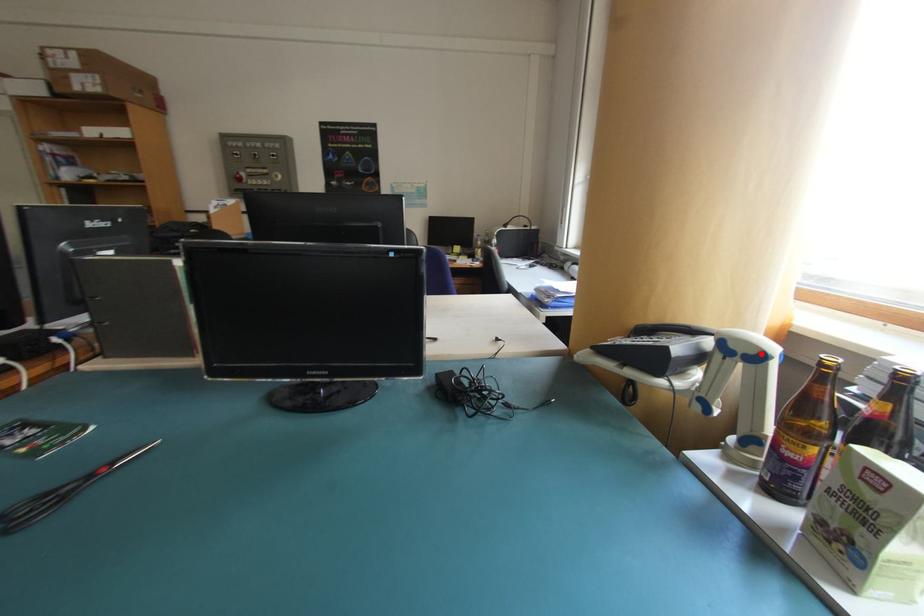
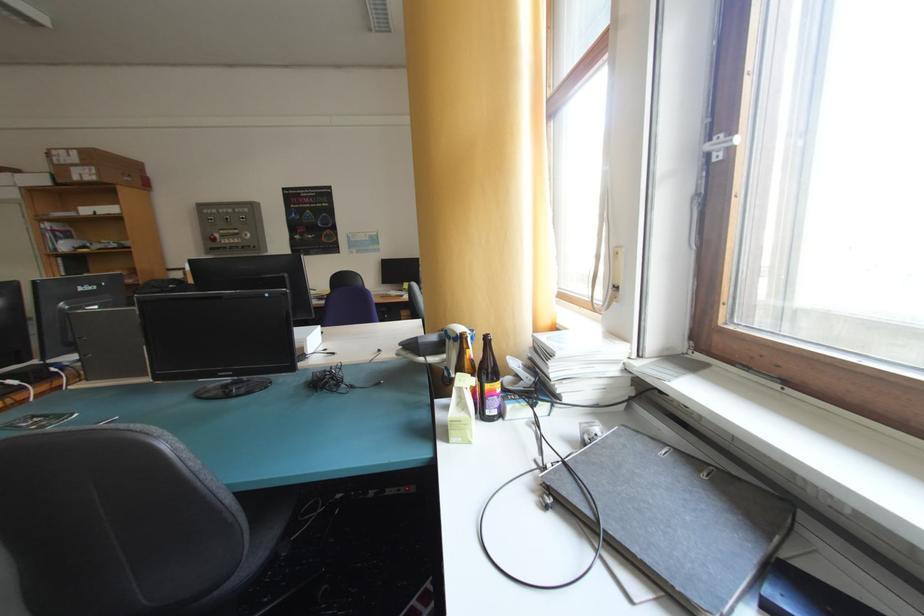
In the second image, find the point that corresponds to the highlighted location in the first image.

(464, 337)